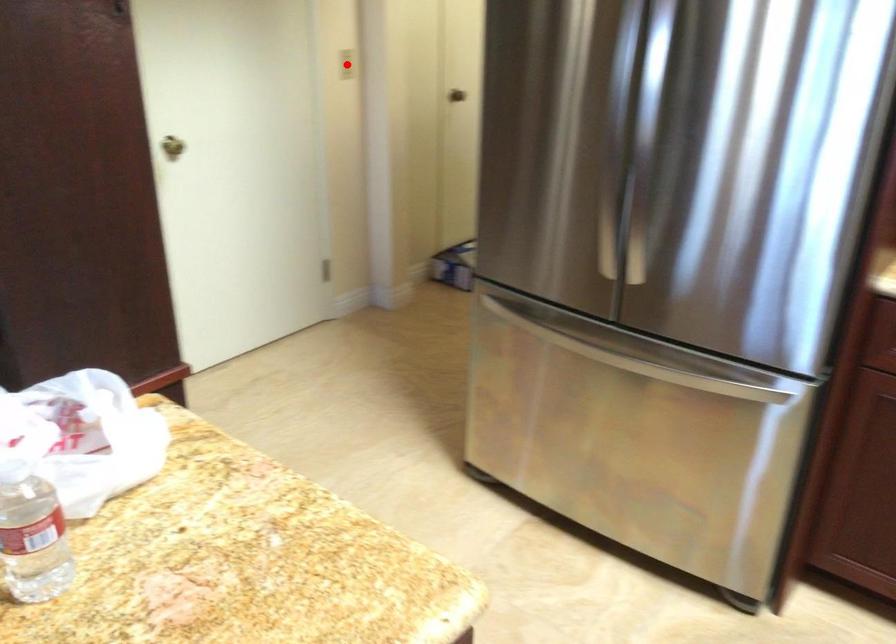
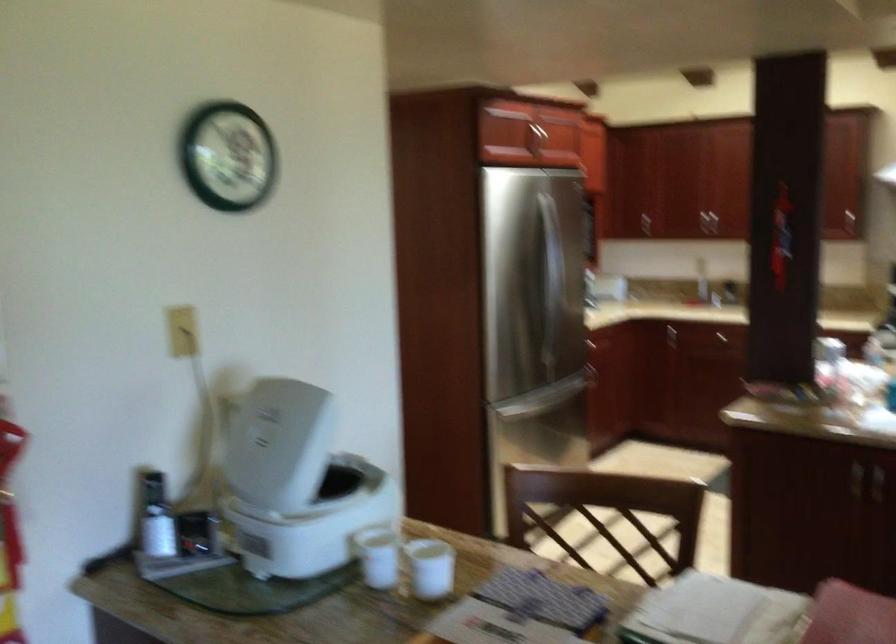
Question: I am providing you with two images of the same scene from different viewpoints. A red point is marked on the first image. At the location where the point appears in image 1, is it still visible in image 2?

Choices:
 (A) Yes
 (B) No

Answer: (B)